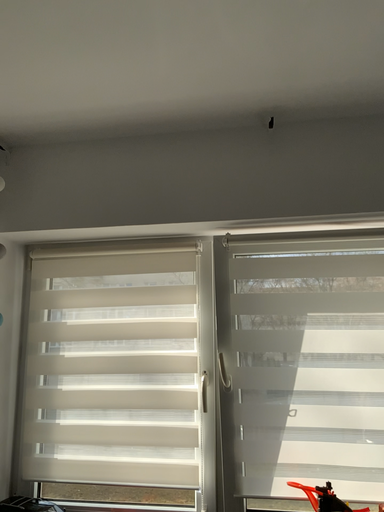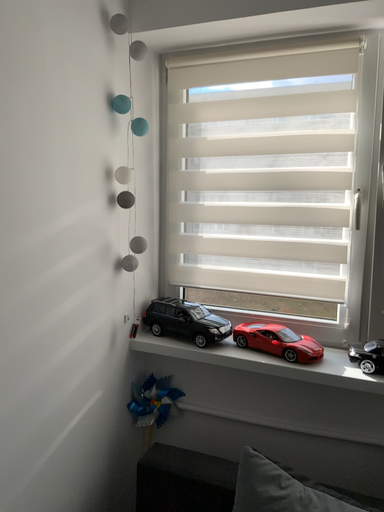
Question: How did the camera likely rotate when shooting the video?

Choices:
 (A) rotated upward
 (B) rotated downward

Answer: (B)